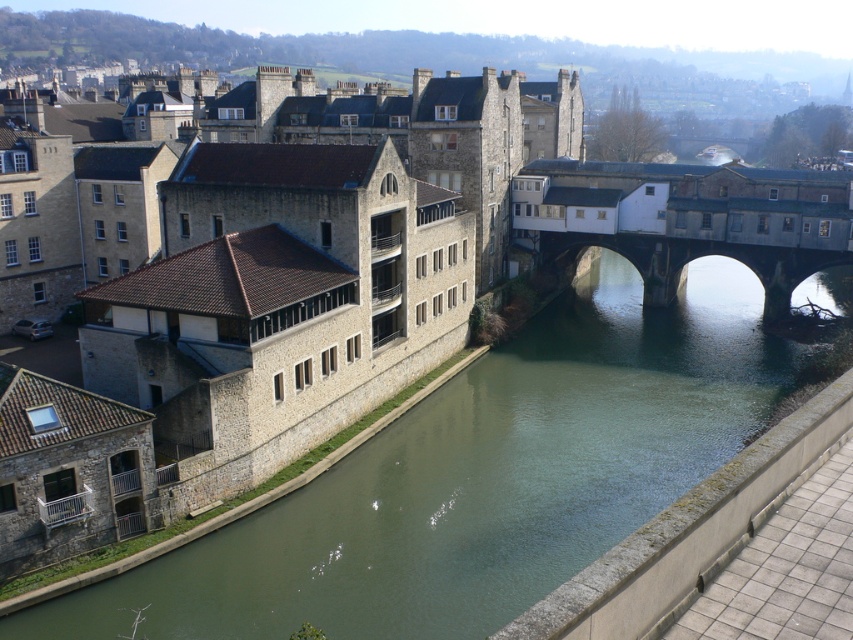
Who is more forward, (331, 227) or (792, 285)?

Point (331, 227)

Where is `stone building at center`? This screenshot has height=640, width=853. stone building at center is located at coordinates (277, 288).

Is stone building at center shorter than green stone river at center?

No.

Who is more distant from viewer, (517, 152) or (604, 285)?

The point (604, 285) is behind.

This screenshot has width=853, height=640. What are the coordinates of `stone building at center` in the screenshot? It's located at (277, 288).

Is green stone river at center thinner than stone arch bridge at center?

In fact, green stone river at center might be wider than stone arch bridge at center.

Who is positioned more to the left, green stone river at center or stone arch bridge at center?

green stone river at center is more to the left.

What do you see at coordinates (480, 477) in the screenshot? I see `green stone river at center` at bounding box center [480, 477].

You are a GUI agent. You are given a task and a screenshot of the screen. Output one action in this format:
    pyautogui.click(x=<x>, y=<y>)
    Task: Click on the green stone river at center
    This screenshot has height=640, width=853.
    Given the screenshot: What is the action you would take?
    pyautogui.click(x=480, y=477)